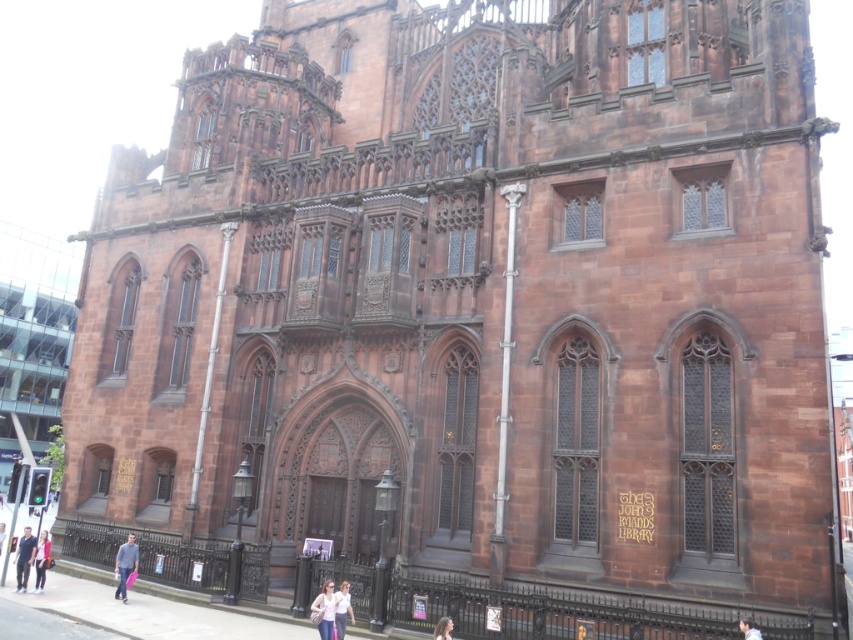
You are standing at the entrance of the John Rylands Library and notice a denim jacket at lower center and light blue jeans at lower left. If you want to retrieve both items, which direction should you move first to reach the closest item?

The denim jacket at lower center is closer to you than the light blue jeans at lower left, so you should move towards the denim jacket at lower center first.

You are a fashion designer observing a mannequin in the John Rylands Library. The mannequin is wearing light blue jeans at lower left and a white cotton shirt at center. Which clothing item is wider?

The light blue jeans at lower left is wider than the white cotton shirt at center.

You are standing in front of the John Rylands Library and see the light blue jeans at lower left and the white cotton shirt at center. Which clothing item is positioned lower in the scene?

The light blue jeans at lower left is positioned below the white cotton shirt at center, so it is lower in the scene.